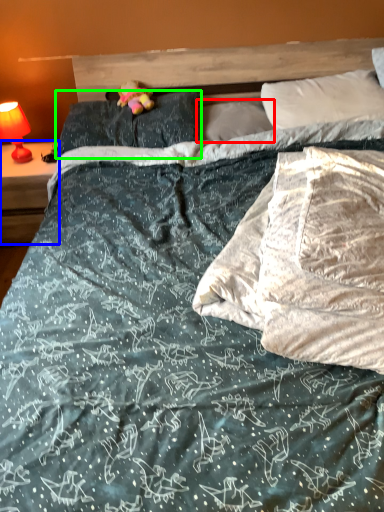
Question: Based on their relative distances, which object is nearer to pillow (highlighted by a red box)? Choose from nightstand (highlighted by a blue box) and pillow (highlighted by a green box).

Choices:
 (A) nightstand
 (B) pillow

Answer: (B)